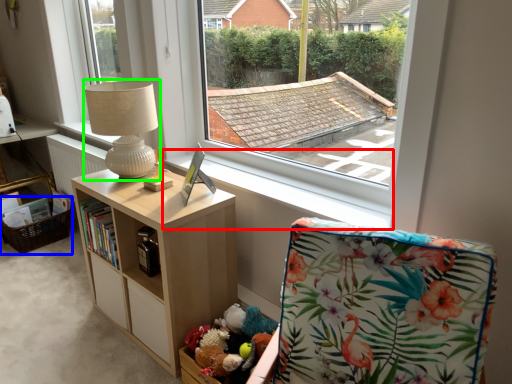
Question: Which is nearer to the window sill (highlighted by a red box)? basket (highlighted by a blue box) or table lamp (highlighted by a green box).

Choices:
 (A) basket
 (B) table lamp

Answer: (B)